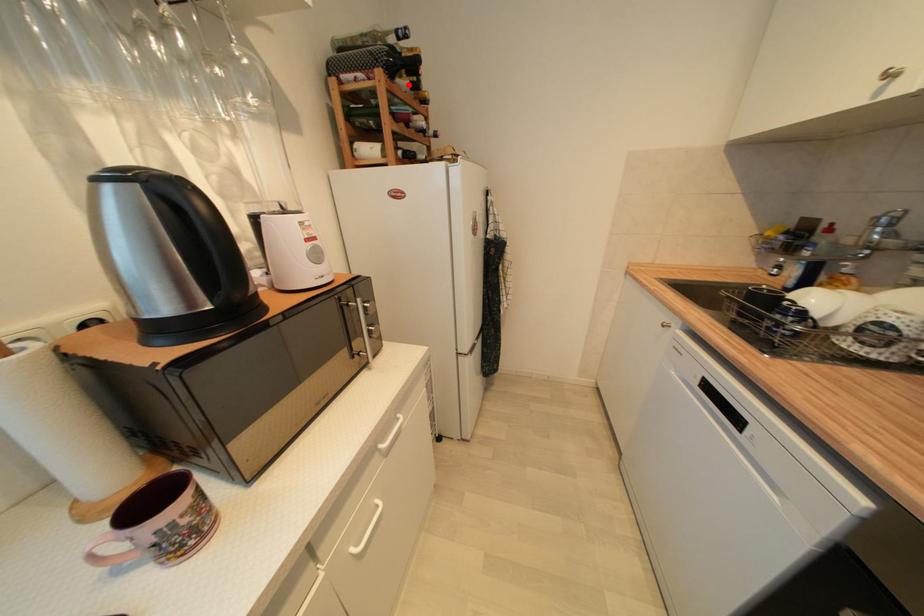
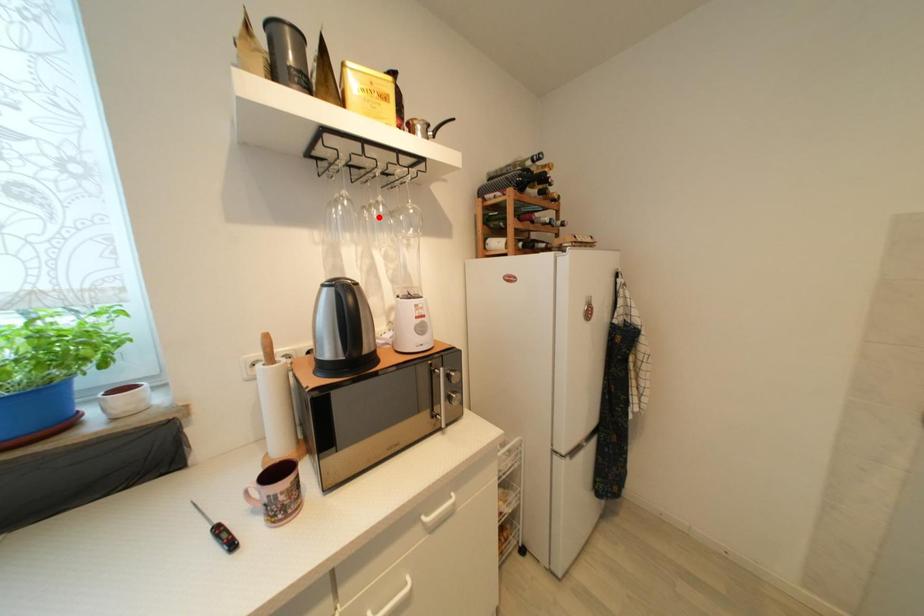
I am providing you with two images of the same scene from different viewpoints. A red point is marked on the first image and another point is marked on the second image. Does the point marked in image1 correspond to the same location as the one in image2?

No